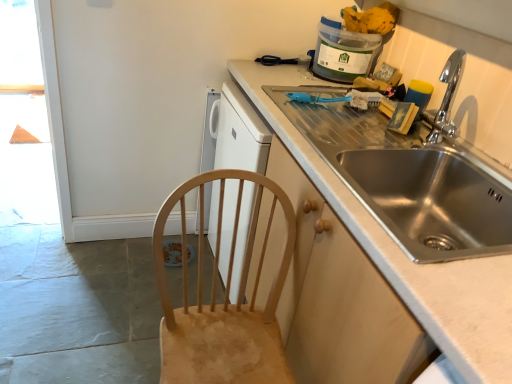
Question: Is natural wood chair at lower left inside stainless steel sink at right?

Choices:
 (A) yes
 (B) no

Answer: (B)

Question: From the image's perspective, is stainless steel sink at right located beneath natural wood chair at lower left?

Choices:
 (A) no
 (B) yes

Answer: (A)

Question: Does stainless steel sink at right have a smaller size compared to natural wood chair at lower left?

Choices:
 (A) yes
 (B) no

Answer: (B)

Question: Is stainless steel sink at right in front of natural wood chair at lower left?

Choices:
 (A) yes
 (B) no

Answer: (B)

Question: Does stainless steel sink at right turn towards natural wood chair at lower left?

Choices:
 (A) yes
 (B) no

Answer: (A)

Question: Is translucent plastic container at upper right inside the boundaries of natural wood chair at lower left, or outside?

Choices:
 (A) outside
 (B) inside

Answer: (A)

Question: Considering the positions of point (327, 51) and point (234, 311), is point (327, 51) closer or farther from the camera than point (234, 311)?

Choices:
 (A) closer
 (B) farther

Answer: (B)

Question: Visually, is translucent plastic container at upper right positioned to the left or to the right of natural wood chair at lower left?

Choices:
 (A) right
 (B) left

Answer: (A)

Question: Based on their sizes in the image, would you say translucent plastic container at upper right is bigger or smaller than natural wood chair at lower left?

Choices:
 (A) small
 (B) big

Answer: (A)

Question: Looking at their shapes, would you say stainless steel sink at right is wider or thinner than natural wood chair at lower left?

Choices:
 (A) thin
 (B) wide

Answer: (B)

Question: Would you say stainless steel sink at right is to the left or to the right of natural wood chair at lower left in the picture?

Choices:
 (A) left
 (B) right

Answer: (B)

Question: From their relative heights in the image, would you say stainless steel sink at right is taller or shorter than natural wood chair at lower left?

Choices:
 (A) tall
 (B) short

Answer: (A)

Question: From a real-world perspective, relative to natural wood chair at lower left, is stainless steel sink at right vertically above or below?

Choices:
 (A) below
 (B) above

Answer: (B)

Question: Which is correct: natural wood chair at lower left is inside stainless steel sink at right, or outside of it?

Choices:
 (A) outside
 (B) inside

Answer: (A)

Question: From a real-world perspective, relative to stainless steel sink at right, is natural wood chair at lower left vertically above or below?

Choices:
 (A) below
 (B) above

Answer: (A)